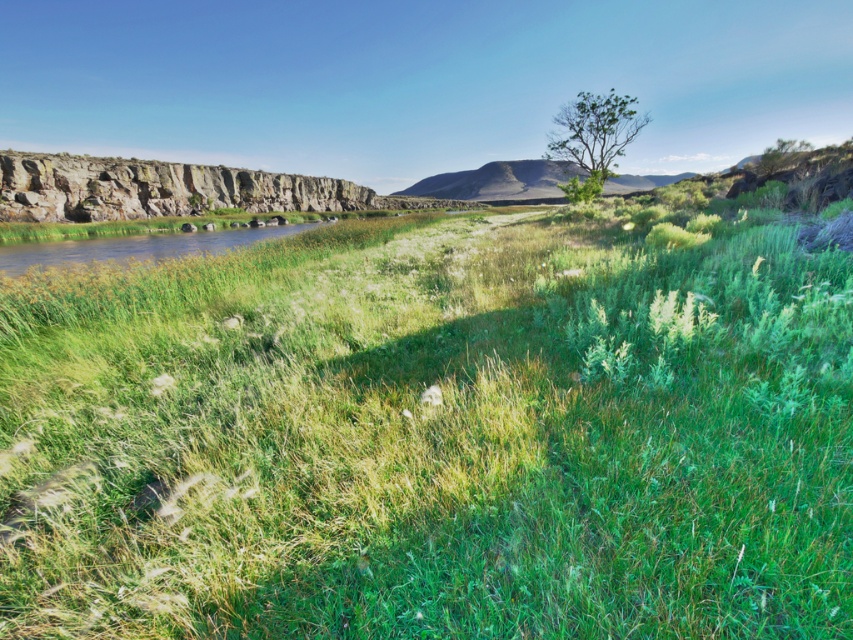
Question: Based on their relative distances, which object is nearer to the rugged brown hillside at center?

Choices:
 (A) green leafy tree at upper center
 (B) green grassy at center
 (C) rugged stone cliff at left

Answer: (C)

Question: Can you confirm if rugged stone cliff at left is positioned below rugged brown hillside at center?

Choices:
 (A) no
 (B) yes

Answer: (B)

Question: Estimate the real-world distances between objects in this image. Which object is closer to the green leafy tree at upper center?

Choices:
 (A) rugged brown hillside at center
 (B) green grassy at center
 (C) rugged stone cliff at left

Answer: (B)

Question: Is rugged brown hillside at center to the left of green leafy tree at upper center from the viewer's perspective?

Choices:
 (A) yes
 (B) no

Answer: (B)

Question: Does green grassy at center have a larger size compared to rugged stone cliff at left?

Choices:
 (A) no
 (B) yes

Answer: (A)

Question: Estimate the real-world distances between objects in this image. Which object is farther from the green leafy tree at upper center?

Choices:
 (A) green grassy at center
 (B) rugged stone cliff at left
 (C) rugged brown hillside at center

Answer: (C)